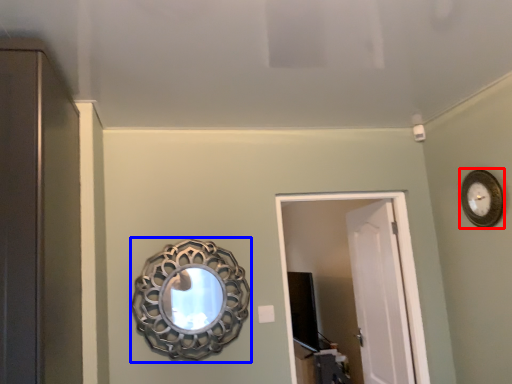
Question: Which object is further to the camera taking this photo, clock (highlighted by a red box) or mirror (highlighted by a blue box)?

Choices:
 (A) clock
 (B) mirror

Answer: (B)